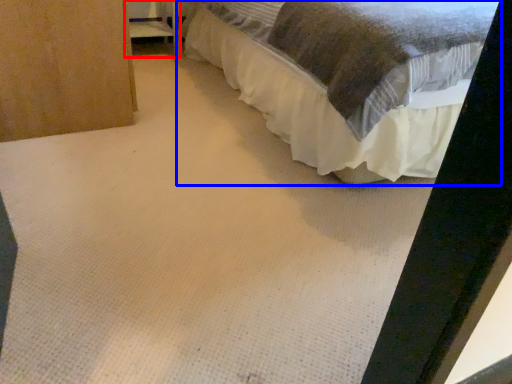
Question: Which object is closer to the camera taking this photo, furniture (highlighted by a red box) or bed (highlighted by a blue box)?

Choices:
 (A) furniture
 (B) bed

Answer: (B)